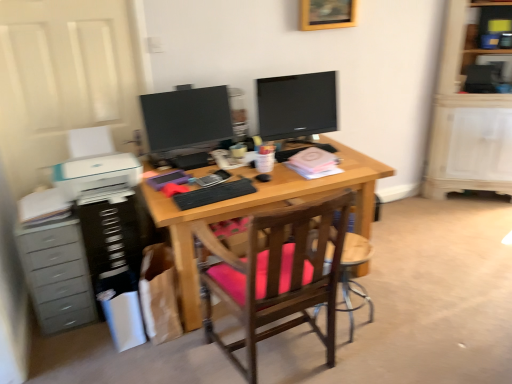
At what (x,y) coordinates should I click in order to perform the action: click on vacant area that is situated to the right of wooden chair with pink cushion at center. Please return your answer as a coordinate pair (x, y). Looking at the image, I should click on (388, 348).